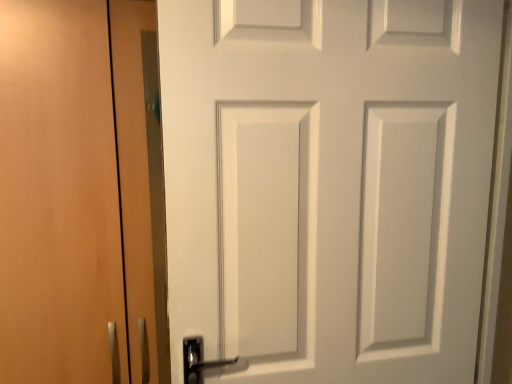
Image resolution: width=512 pixels, height=384 pixels. What do you see at coordinates (74, 191) in the screenshot?
I see `matte wood cabinet at left` at bounding box center [74, 191].

The height and width of the screenshot is (384, 512). What are the coordinates of `matte wood cabinet at left` in the screenshot? It's located at (74, 191).

Consider the image. What is the approximate width of matte wood cabinet at left?

It is 58.33 centimeters.

Measure the distance between point (54, 377) and camera.

A distance of 1.02 meters exists between point (54, 377) and camera.

Locate an element on the screen. This screenshot has width=512, height=384. white matte door at center is located at coordinates (328, 186).

What do you see at coordinates (328, 186) in the screenshot? I see `white matte door at center` at bounding box center [328, 186].

I want to click on matte wood cabinet at left, so click(x=74, y=191).

Does matte wood cabinet at left appear on the right side of white matte door at center?

No, matte wood cabinet at left is not to the right of white matte door at center.

Does matte wood cabinet at left come behind white matte door at center?

Yes, matte wood cabinet at left is further from the camera.

Is point (136, 295) less distant than point (426, 240)?

No, (136, 295) is further to viewer.

From the image's perspective, is matte wood cabinet at left located above or below white matte door at center?

matte wood cabinet at left is below white matte door at center.

From a real-world perspective, is matte wood cabinet at left below white matte door at center?

Yes, from a real-world perspective, matte wood cabinet at left is under white matte door at center.

Between matte wood cabinet at left and white matte door at center, which one has smaller width?

white matte door at center is thinner.

Is matte wood cabinet at left shorter than white matte door at center?

Incorrect, the height of matte wood cabinet at left does not fall short of that of white matte door at center.

Is matte wood cabinet at left bigger than white matte door at center?

Indeed, matte wood cabinet at left has a larger size compared to white matte door at center.

Is matte wood cabinet at left inside the boundaries of white matte door at center, or outside?

The correct answer is: outside.

Would you consider matte wood cabinet at left to be distant from white matte door at center?

No, matte wood cabinet at left is not far away from white matte door at center.

Is white matte door at center at the back of matte wood cabinet at left?

No, matte wood cabinet at left is not facing away from white matte door at center.

How many degrees apart are the facing directions of matte wood cabinet at left and white matte door at center?

The angle between the facing direction of matte wood cabinet at left and the facing direction of white matte door at center is 5.54 degrees.

Locate an element on the screen. The image size is (512, 384). door that appears above the matte wood cabinet at left (from a real-world perspective) is located at coordinates (328, 186).

Between white matte door at center and matte wood cabinet at left, which one appears on the left side from the viewer's perspective?

From the viewer's perspective, matte wood cabinet at left appears more on the left side.

From the picture: Considering the relative positions of white matte door at center and matte wood cabinet at left in the image provided, is white matte door at center in front of matte wood cabinet at left?

Yes, it is in front of matte wood cabinet at left.

Considering the positions of point (170, 177) and point (27, 236), is point (170, 177) closer or farther from the camera than point (27, 236)?

Point (170, 177).

From the image's perspective, does white matte door at center appear higher than matte wood cabinet at left?

Yes.

From a real-world perspective, who is located lower, white matte door at center or matte wood cabinet at left?

matte wood cabinet at left is physically lower.

Can you confirm if white matte door at center is wider than matte wood cabinet at left?

In fact, white matte door at center might be narrower than matte wood cabinet at left.

Considering the sizes of objects white matte door at center and matte wood cabinet at left in the image provided, who is shorter, white matte door at center or matte wood cabinet at left?

white matte door at center.

Which of these two, white matte door at center or matte wood cabinet at left, is bigger?

With larger size is matte wood cabinet at left.

Which is correct: white matte door at center is inside matte wood cabinet at left, or outside of it?

white matte door at center cannot be found inside matte wood cabinet at left.

Can you see white matte door at center touching matte wood cabinet at left?

No, white matte door at center is not making contact with matte wood cabinet at left.

Is white matte door at center looking in the opposite direction of matte wood cabinet at left?

white matte door at center does not have its back to matte wood cabinet at left.

Based on the photo, what's the angular difference between white matte door at center and matte wood cabinet at left's facing directions?

The angular difference between white matte door at center and matte wood cabinet at left is 5.54 degrees.

Find the location of a particular element. garage door that is on the left side of white matte door at center is located at coordinates (74, 191).

The height and width of the screenshot is (384, 512). Identify the location of door above the matte wood cabinet at left (from a real-world perspective). (328, 186).

What are the coordinates of `garage door on the left of white matte door at center` in the screenshot? It's located at (74, 191).